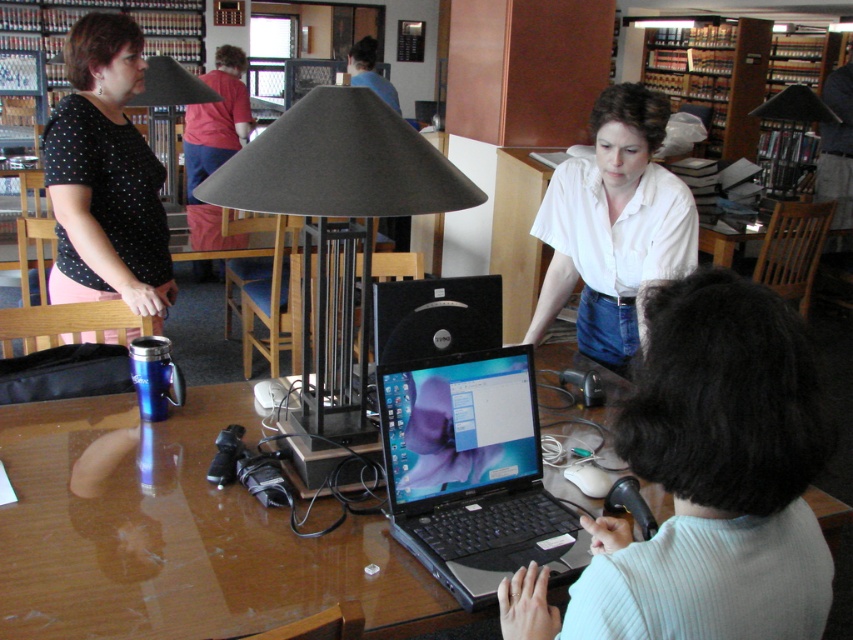
Question: Is white smooth shirt at upper center wider than black dotted shirt at upper left?

Choices:
 (A) yes
 (B) no

Answer: (A)

Question: Is black plastic laptop at center bigger than dark gray felt lampshade at upper left?

Choices:
 (A) yes
 (B) no

Answer: (B)

Question: Among these objects, which one is nearest to the camera?

Choices:
 (A) glossy wood table at center
 (B) white smooth shirt at upper center
 (C) black dotted shirt at upper left
 (D) black plastic laptop at center

Answer: (A)

Question: Does light blue sweater at lower right appear over wooden bookshelf at upper right?

Choices:
 (A) yes
 (B) no

Answer: (B)

Question: Which point is farther from the camera taking this photo?

Choices:
 (A) (741, 22)
 (B) (129, 557)
 (C) (131, 275)
 (D) (241, 150)

Answer: (A)

Question: Which object appears closest to the camera in this image?

Choices:
 (A) light blue sweater at lower right
 (B) black matte lamp at center

Answer: (A)